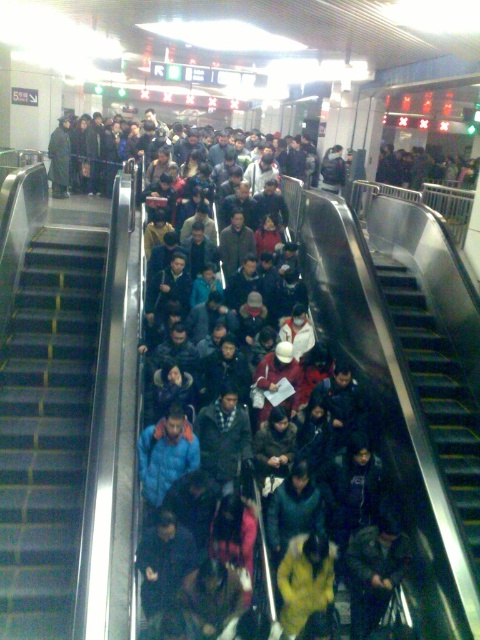
Is dark blue jacket at center shorter than metallic gray stairs at center?

No.

What are the coordinates of `dark blue jacket at center` in the screenshot? It's located at (356, 321).

In the scene shown: Can you confirm if metallic silver escalator at center is positioned below dark blue jacket at center?

Correct, metallic silver escalator at center is located below dark blue jacket at center.

Image resolution: width=480 pixels, height=640 pixels. What are the coordinates of `metallic silver escalator at center` in the screenshot? It's located at (388, 413).

Is metallic gray stairs at left bigger than metallic gray stairs at center?

Yes.

Does metallic gray stairs at left appear on the left side of metallic gray stairs at center?

Correct, you'll find metallic gray stairs at left to the left of metallic gray stairs at center.

Is point (36, 580) in front of point (423, 310)?

Yes, point (36, 580) is in front of point (423, 310).

What are the coordinates of `metallic gray stairs at left` in the screenshot? It's located at (47, 428).